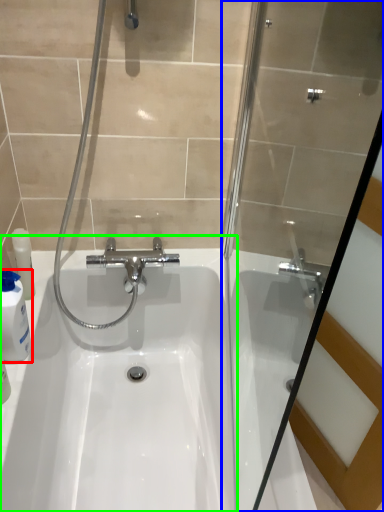
Question: Which is farther away from cleaning product (highlighted by a red box)? shower door (highlighted by a blue box) or sink (highlighted by a green box)?

Choices:
 (A) shower door
 (B) sink

Answer: (A)